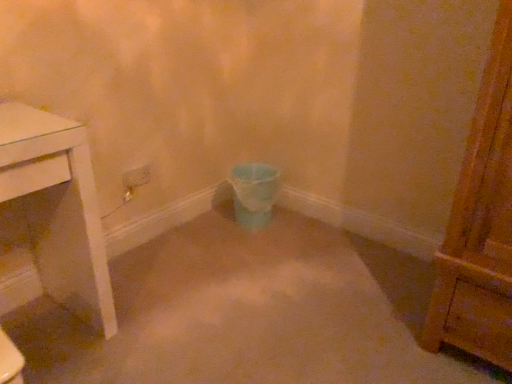
Question: From a real-world perspective, is matte blue plastic toilet bowl at center on white plastic power plugs and sockets at center?

Choices:
 (A) yes
 (B) no

Answer: (B)

Question: Is matte blue plastic toilet bowl at center taller than white plastic power plugs and sockets at center?

Choices:
 (A) yes
 (B) no

Answer: (A)

Question: Does matte blue plastic toilet bowl at center appear on the left side of white plastic power plugs and sockets at center?

Choices:
 (A) no
 (B) yes

Answer: (A)

Question: From the image's perspective, is matte blue plastic toilet bowl at center located above white plastic power plugs and sockets at center?

Choices:
 (A) yes
 (B) no

Answer: (B)

Question: Considering the relative positions of matte blue plastic toilet bowl at center and white plastic power plugs and sockets at center in the image provided, is matte blue plastic toilet bowl at center behind white plastic power plugs and sockets at center?

Choices:
 (A) yes
 (B) no

Answer: (A)

Question: Does matte blue plastic toilet bowl at center have a lesser height compared to white plastic power plugs and sockets at center?

Choices:
 (A) no
 (B) yes

Answer: (A)

Question: Considering the relative sizes of white plastic power plugs and sockets at center and matte blue plastic toilet bowl at center in the image provided, is white plastic power plugs and sockets at center bigger than matte blue plastic toilet bowl at center?

Choices:
 (A) no
 (B) yes

Answer: (A)

Question: Considering the relative sizes of white plastic power plugs and sockets at center and matte blue plastic toilet bowl at center in the image provided, is white plastic power plugs and sockets at center shorter than matte blue plastic toilet bowl at center?

Choices:
 (A) no
 (B) yes

Answer: (B)

Question: Is the position of white plastic power plugs and sockets at center less distant than that of matte blue plastic toilet bowl at center?

Choices:
 (A) yes
 (B) no

Answer: (A)

Question: Is matte blue plastic toilet bowl at center surrounded by white plastic power plugs and sockets at center?

Choices:
 (A) yes
 (B) no

Answer: (B)

Question: From a real-world perspective, is white plastic power plugs and sockets at center below matte blue plastic toilet bowl at center?

Choices:
 (A) yes
 (B) no

Answer: (B)

Question: From a real-world perspective, is white plastic power plugs and sockets at center on top of matte blue plastic toilet bowl at center?

Choices:
 (A) no
 (B) yes

Answer: (B)

Question: From the image's perspective, is matte blue plastic toilet bowl at center located above or below white plastic power plugs and sockets at center?

Choices:
 (A) above
 (B) below

Answer: (B)